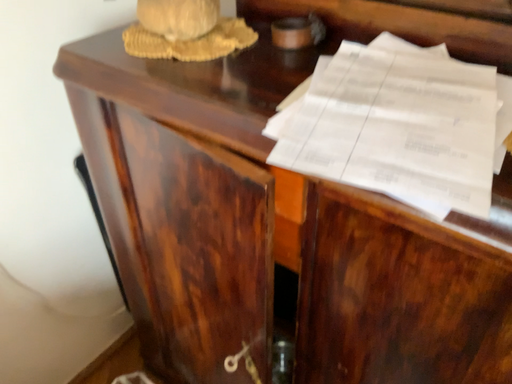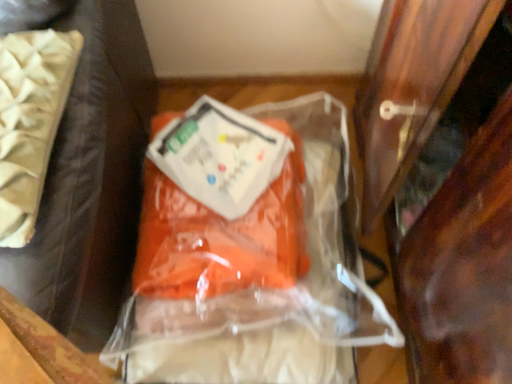
Question: Which way did the camera rotate in the video?

Choices:
 (A) rotated downward
 (B) rotated upward

Answer: (A)